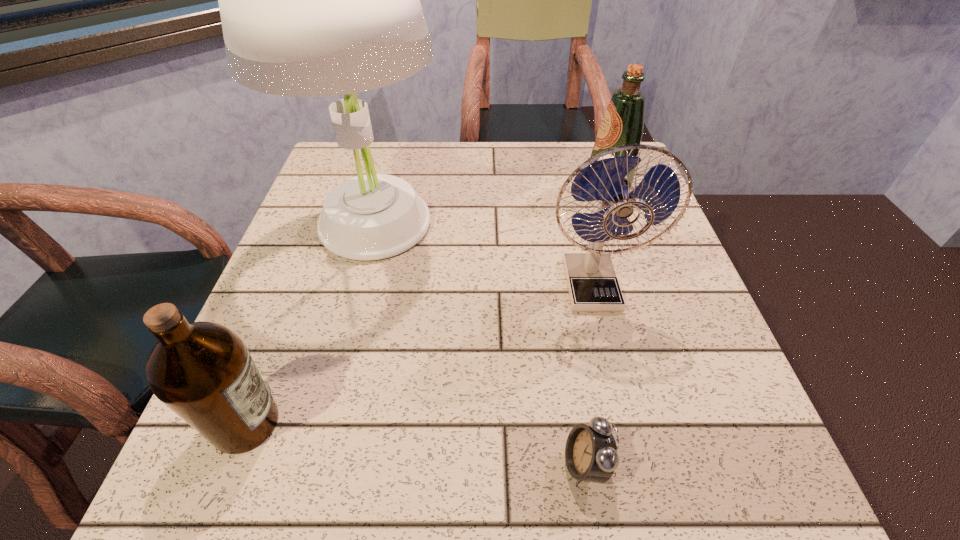
Image resolution: width=960 pixels, height=540 pixels. What are the coordinates of `the tallest object` in the screenshot? It's located at (316, 0).

Find the location of `fan`. fan is located at coordinates (592, 283).

At what (x,y) coordinates should I click in order to perform the action: click on the farther olive oil. Please return your answer as a coordinate pair (x, y). This screenshot has width=960, height=540. Looking at the image, I should click on (623, 122).

Where is `the nearer olive oil`? The image size is (960, 540). the nearer olive oil is located at coordinates (203, 371).

This screenshot has height=540, width=960. I want to click on the shortest object, so click(x=591, y=455).

Where is `vacant space situated 0.280m on the front-facing side of the tallest object`? vacant space situated 0.280m on the front-facing side of the tallest object is located at coordinates (323, 411).

Where is `free space located on the front-facing side of the fan`? The image size is (960, 540). free space located on the front-facing side of the fan is located at coordinates (622, 412).

Locate an element on the screen. free spot located on the front-facing side of the right olive oil is located at coordinates (420, 186).

I want to click on free point located on the front-facing side of the right olive oil, so click(x=485, y=186).

I want to click on blank space located on the front-facing side of the right olive oil, so click(444, 186).